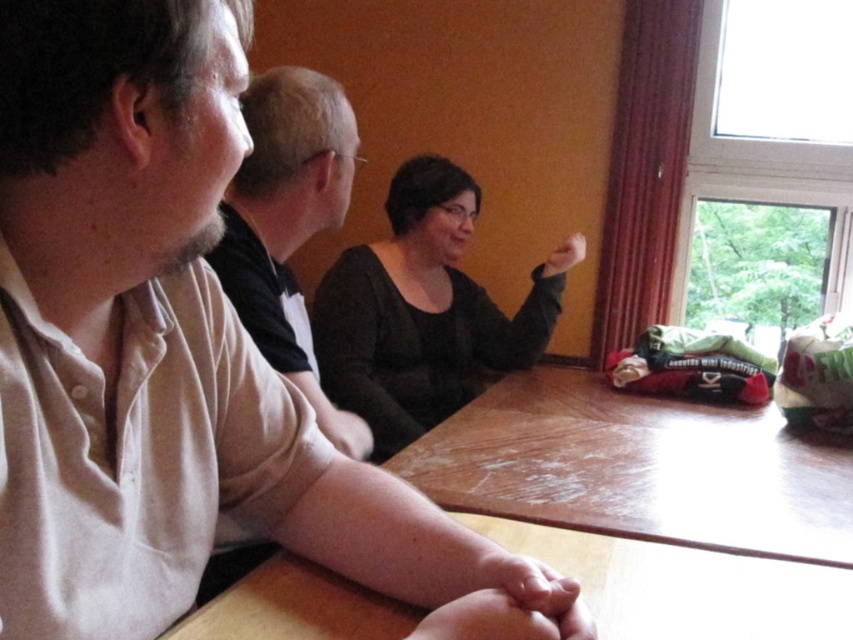
You are sitting at the table and want to pass a note to the person wearing the light beige shirt at left. If you look to your left, which direction should you turn to face the black matte shirt at center?

The black matte shirt at center is to the right of the light beige shirt at left. So, to face the black matte shirt at center from the light beige shirt at left, you should turn to your right.

You are observing the scene from the camera position. There are two points marked on the table in the image, one labeled as point (502, 525) and the other as point (570, 253). Which of these two points appears closer to you?

Point (502, 525) is closer to the camera than point (570, 253).

You are a photographer standing behind the black matte shirt at center. You want to take a photo of the wooden table at center without any obstruction. Can you do that?

The wooden table at center is in front of the black matte shirt at center, so if you are standing behind the black matte shirt at center, the wooden table at center would block your view. Therefore, you cannot take a photo of the wooden table at center without obstruction.